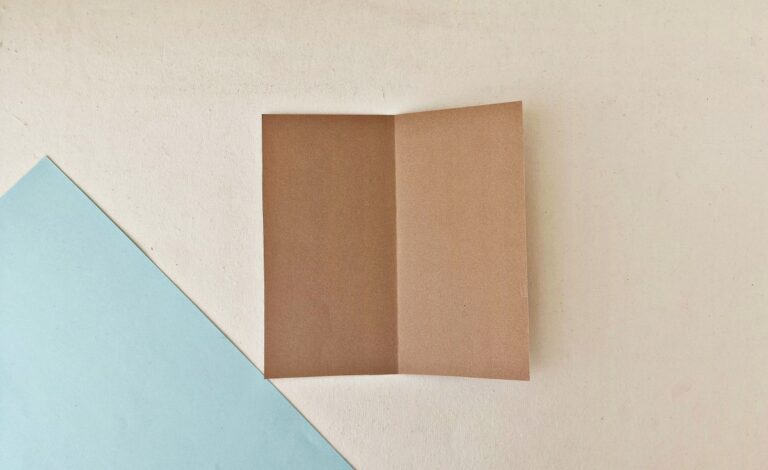
At what (x,y) coordinates should I click in order to perform the action: click on beige table. Please return your answer as a coordinate pair (x, y). The width and height of the screenshot is (768, 470). Looking at the image, I should click on (581, 300).